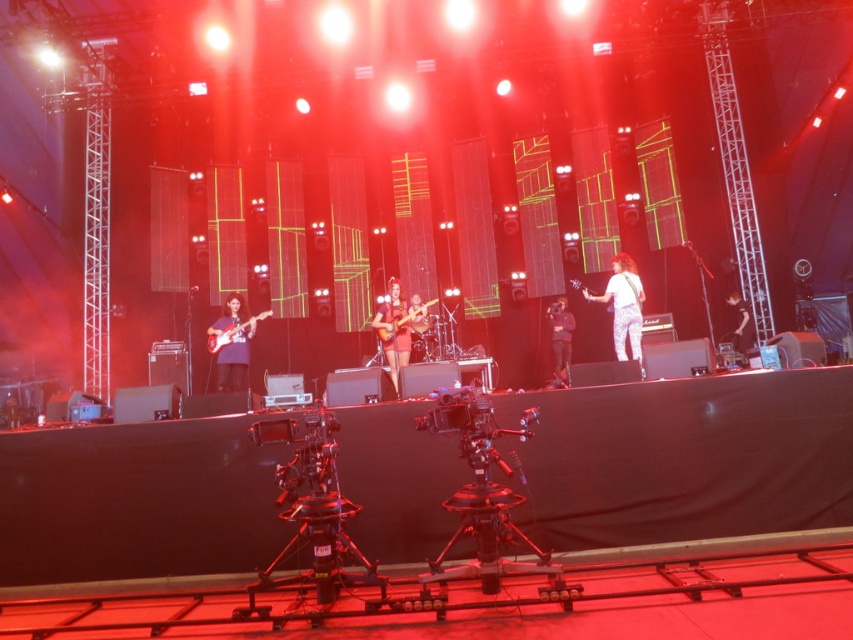
Question: Which of the following is the closest to the observer?

Choices:
 (A) shiny black guitar at center
 (B) glossy wood guitar at center

Answer: (B)

Question: Is white textured pants at center behind shiny black guitar at center?

Choices:
 (A) no
 (B) yes

Answer: (A)

Question: Which object is farther from the camera taking this photo?

Choices:
 (A) matte pink guitar at center
 (B) matte black electric guitar at left
 (C) matte purple guitar at left

Answer: (A)

Question: Is matte purple guitar at left positioned behind shiny black guitar at center?

Choices:
 (A) no
 (B) yes

Answer: (A)

Question: Among these points, which one is farthest from the camera?

Choices:
 (A) (630, 273)
 (B) (227, 332)
 (C) (381, 332)
 (D) (392, 328)

Answer: (A)

Question: Where is white textured pants at center located in relation to matte black electric guitar at left in the image?

Choices:
 (A) right
 (B) left

Answer: (A)